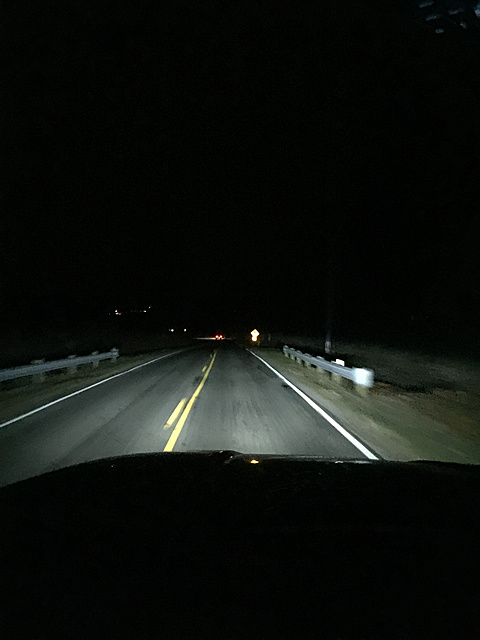
This screenshot has width=480, height=640. Identify the location of hood. coord(285,508).